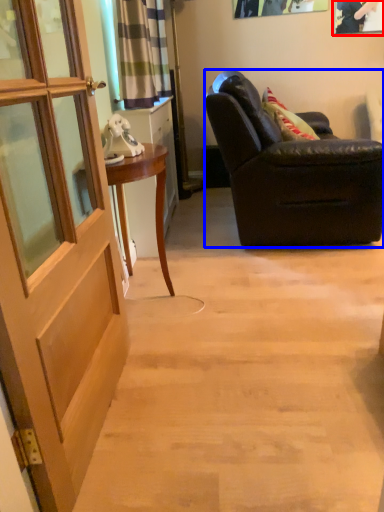
Question: Which of the following is the closest to the observer, picture frame (highlighted by a red box) or chair (highlighted by a blue box)?

Choices:
 (A) picture frame
 (B) chair

Answer: (B)